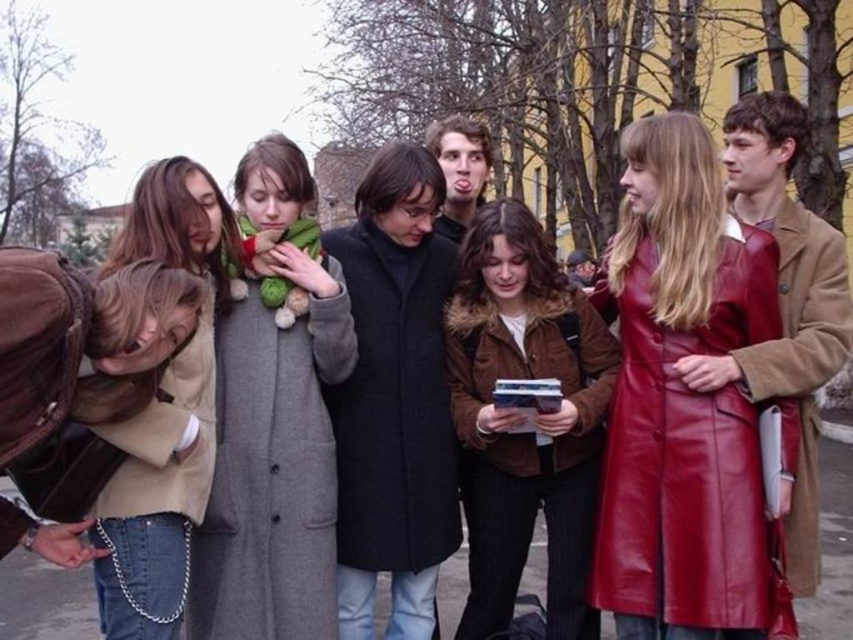
You are a photographer trying to capture a photo of the smooth brown coat at center without the leather coat at right blocking it. Based on the scene, is there a way to adjust your position to achieve this?

The leather coat at right is in front of the smooth brown coat at center, so moving to a position where the photographer can angle the camera around or behind the leather coat at right might allow capturing the smooth brown coat at center without obstruction.

You are standing at the origin point in the image. Which direction do you need to move to reach the dark gray wool coat at center?

The dark gray wool coat at center is located at point 0.623 on the x axis and 0.463 on the y axis. Since the origin is at the bottom left corner of the image, you need to move to the right and slightly upwards to reach it.